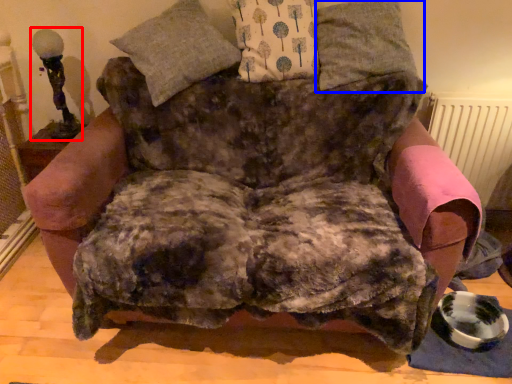
Question: Which object is further to the camera taking this photo, table lamp (highlighted by a red box) or pillow (highlighted by a blue box)?

Choices:
 (A) table lamp
 (B) pillow

Answer: (A)